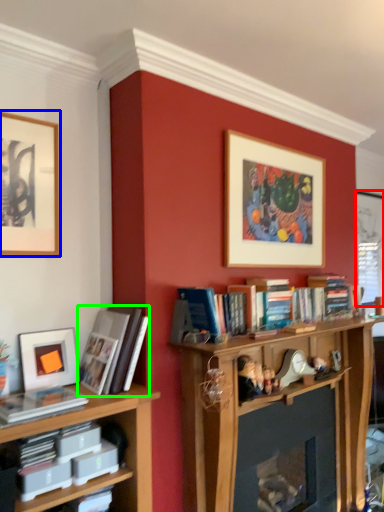
Question: Based on their relative distances, which object is nearer to window screen (highlighted by a red box)? Choose from picture frame (highlighted by a blue box) and book (highlighted by a green box).

Choices:
 (A) picture frame
 (B) book

Answer: (B)